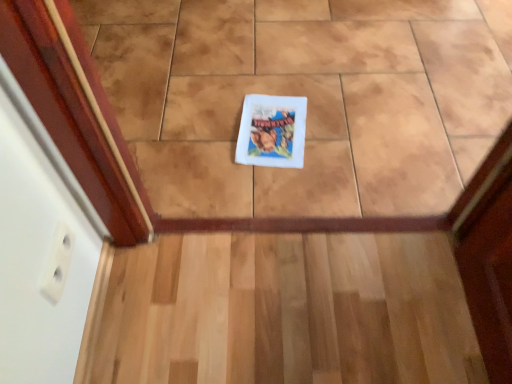
At what (x,y) coordinates should I click in order to perform the action: click on light wood stairs at center. Please return your answer as a coordinate pair (x, y). The image size is (512, 384). Looking at the image, I should click on (285, 311).

In order to face light wood stairs at center, should I rotate leftwards or rightwards?

You should rotate right by 6.507 degrees.

Describe the element at coordinates (285, 311) in the screenshot. The height and width of the screenshot is (384, 512). I see `light wood stairs at center` at that location.

The height and width of the screenshot is (384, 512). Describe the element at coordinates (272, 131) in the screenshot. I see `white matte book cover at center` at that location.

Where is `white matte book cover at center`? The height and width of the screenshot is (384, 512). white matte book cover at center is located at coordinates (272, 131).

Locate an element on the screen. The height and width of the screenshot is (384, 512). light wood stairs at center is located at coordinates (285, 311).

Considering the relative positions of light wood stairs at center and white matte book cover at center in the image provided, is light wood stairs at center to the right of white matte book cover at center from the viewer's perspective?

Yes.

Who is more distant, light wood stairs at center or white matte book cover at center?

white matte book cover at center is behind.

Is point (224, 377) positioned in front of point (279, 116)?

Yes, it is in front of point (279, 116).

From the image's perspective, which is above, light wood stairs at center or white matte book cover at center?

From the image's view, white matte book cover at center is above.

From a real-world perspective, is light wood stairs at center under white matte book cover at center?

Yes, from a real-world perspective, light wood stairs at center is below white matte book cover at center.

Is light wood stairs at center wider or thinner than white matte book cover at center?

light wood stairs at center is wider than white matte book cover at center.

Considering the relative sizes of light wood stairs at center and white matte book cover at center in the image provided, is light wood stairs at center taller than white matte book cover at center?

In fact, light wood stairs at center may be shorter than white matte book cover at center.

Considering the sizes of objects light wood stairs at center and white matte book cover at center in the image provided, who is smaller, light wood stairs at center or white matte book cover at center?

white matte book cover at center is smaller.

Is light wood stairs at center positioned beyond the bounds of white matte book cover at center?

Indeed, light wood stairs at center is completely outside white matte book cover at center.

Is the surface of light wood stairs at center in direct contact with white matte book cover at center?

No, light wood stairs at center is not with white matte book cover at center.

Is light wood stairs at center facing away from white matte book cover at center?

No, light wood stairs at center is not facing the opposite direction of white matte book cover at center.

I want to click on book cover located above the light wood stairs at center (from the image's perspective), so click(272, 131).

Is white matte book cover at center at the left side of light wood stairs at center?

Yes, white matte book cover at center is to the left of light wood stairs at center.

Considering the positions of objects white matte book cover at center and light wood stairs at center in the image provided, who is in front, white matte book cover at center or light wood stairs at center?

light wood stairs at center is in front.

Which is closer, (x=260, y=165) or (x=222, y=347)?

Point (x=260, y=165) is positioned farther from the camera compared to point (x=222, y=347).

From the image's perspective, who appears lower, white matte book cover at center or light wood stairs at center?

light wood stairs at center, from the image's perspective.

From a real-world perspective, which is physically below, white matte book cover at center or light wood stairs at center?

light wood stairs at center, from a real-world perspective.

Looking at their sizes, would you say white matte book cover at center is wider or thinner than light wood stairs at center?

white matte book cover at center is thinner than light wood stairs at center.

Who is shorter, white matte book cover at center or light wood stairs at center?

With less height is light wood stairs at center.

Considering the relative sizes of white matte book cover at center and light wood stairs at center in the image provided, is white matte book cover at center bigger than light wood stairs at center?

No.

Would you say light wood stairs at center is part of white matte book cover at center's contents?

No, light wood stairs at center is located outside of white matte book cover at center.

Are white matte book cover at center and light wood stairs at center beside each other?

white matte book cover at center and light wood stairs at center are clearly separated.

From the picture: Does white matte book cover at center turn towards light wood stairs at center?

Yes, white matte book cover at center faces towards light wood stairs at center.

Looking at this image, how different are the orientations of white matte book cover at center and light wood stairs at center in degrees?

The angular difference between white matte book cover at center and light wood stairs at center is 176 degrees.

Measure the distance from white matte book cover at center to light wood stairs at center.

white matte book cover at center and light wood stairs at center are 17.13 inches apart.

Identify the location of stairs lying below the white matte book cover at center (from the image's perspective). (285, 311).

You are a GUI agent. You are given a task and a screenshot of the screen. Output one action in this format:
    pyautogui.click(x=<x>, y=<y>)
    Task: Click on the book cover positioned vertically above the light wood stairs at center (from a real-world perspective)
    Image resolution: width=512 pixels, height=384 pixels.
    Given the screenshot: What is the action you would take?
    pyautogui.click(x=272, y=131)

The width and height of the screenshot is (512, 384). I want to click on book cover to the left of light wood stairs at center, so click(272, 131).